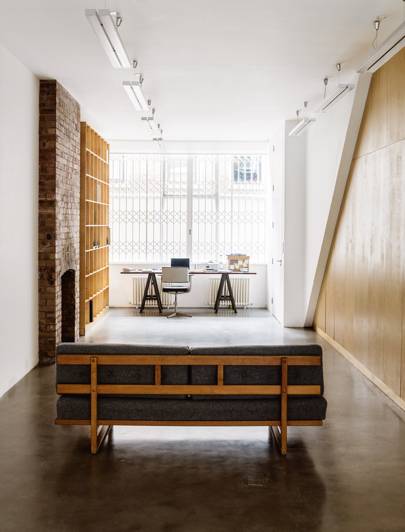
Find the location of a particular element. desk chair is located at coordinates (170, 275).